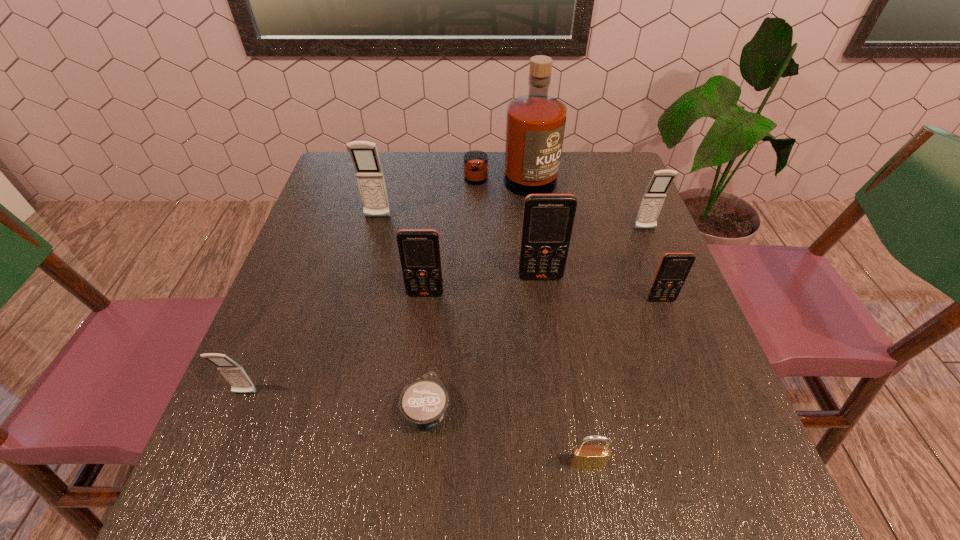
You are a GUI agent. You are given a task and a screenshot of the screen. Output one action in this format:
    pyautogui.click(x=<x>, y=<y>)
    Task: Click on the empty space between the eighth nearest object and the liquor
    
    Given the screenshot: What is the action you would take?
    pyautogui.click(x=444, y=200)

Identify the location of vacant point located between the fourth cellular telephone from right to left and the nearest object. This screenshot has height=540, width=960. (506, 379).

The width and height of the screenshot is (960, 540). I want to click on object that is the sixth closest to the rightmost gray cellular telephone, so click(423, 402).

Identify the location of object that is the third closest one to the shortest object. This screenshot has width=960, height=540. (235, 375).

Locate an element on the screen. cellular telephone that is the third closest one to the fourth cellular telephone from right to left is located at coordinates (235, 375).

Where is `the third closest cellular telephone to the second biggest gray cellular telephone`? Image resolution: width=960 pixels, height=540 pixels. the third closest cellular telephone to the second biggest gray cellular telephone is located at coordinates [419, 249].

Identify which gray cellular telephone is the second nearest to the rightmost gray cellular telephone. Please provide its 2D coordinates. Your answer should be formatted as a tuple, i.e. [(x, y)], where the tuple contains the x and y coordinates of a point satisfying the conditions above.

[(235, 375)]

You are a GUI agent. You are given a task and a screenshot of the screen. Output one action in this format:
    pyautogui.click(x=<x>, y=<y>)
    Task: Click on the third closest gray cellular telephone to the fourth cellular telephone from right to left
    
    Given the screenshot: What is the action you would take?
    pyautogui.click(x=655, y=193)

Identify which orange cellular telephone is located as the second nearest to the third cellular telephone from left to right. Please provide its 2D coordinates. Your answer should be formatted as a tuple, i.e. [(x, y)], where the tuple contains the x and y coordinates of a point satisfying the conditions above.

[(674, 268)]

Choose which orange cellular telephone is the second nearest neighbor to the fourth farthest object. Please provide its 2D coordinates. Your answer should be formatted as a tuple, i.e. [(x, y)], where the tuple contains the x and y coordinates of a point satisfying the conditions above.

[(674, 268)]